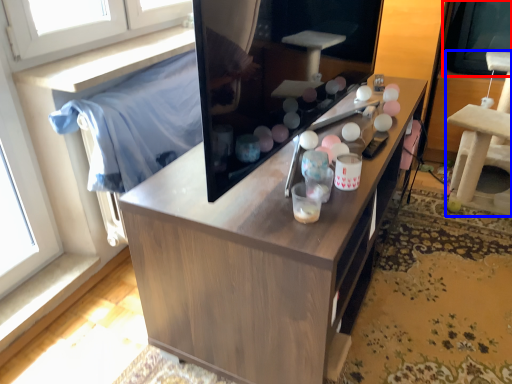
Question: Which point is closer to the camera, window screen (highlighted by a red box) or furniture (highlighted by a blue box)?

Choices:
 (A) window screen
 (B) furniture

Answer: (B)